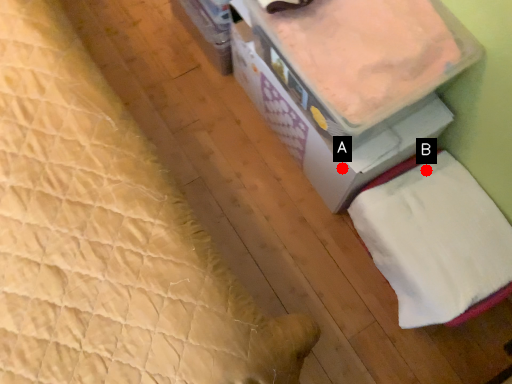
Question: Two points are circled on the image, labeled by A and B beside each circle. Which point appears closest to the camera in this image?

Choices:
 (A) A is closer
 (B) B is closer

Answer: (A)